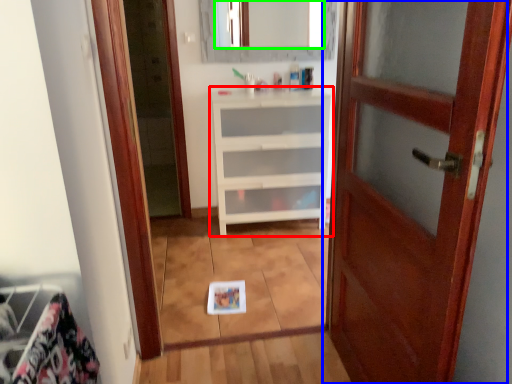
Question: Considering the real-world distances, which object is farthest from chest of drawers (highlighted by a red box)? door (highlighted by a blue box) or mirror (highlighted by a green box)?

Choices:
 (A) door
 (B) mirror

Answer: (B)